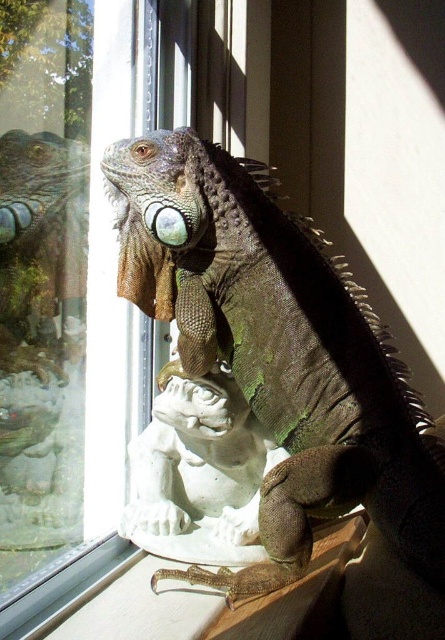
Question: Is clear glass window at center positioned at the back of green scaly lizard at center?

Choices:
 (A) yes
 (B) no

Answer: (B)

Question: Is clear glass window at center positioned at the back of green scaly lizard at center?

Choices:
 (A) no
 (B) yes

Answer: (A)

Question: Observing the image, what is the correct spatial positioning of clear glass window at center in reference to green scaly lizard at center?

Choices:
 (A) above
 (B) below

Answer: (A)

Question: Which point is closer to the camera?

Choices:
 (A) (158, 234)
 (B) (73, 385)

Answer: (A)